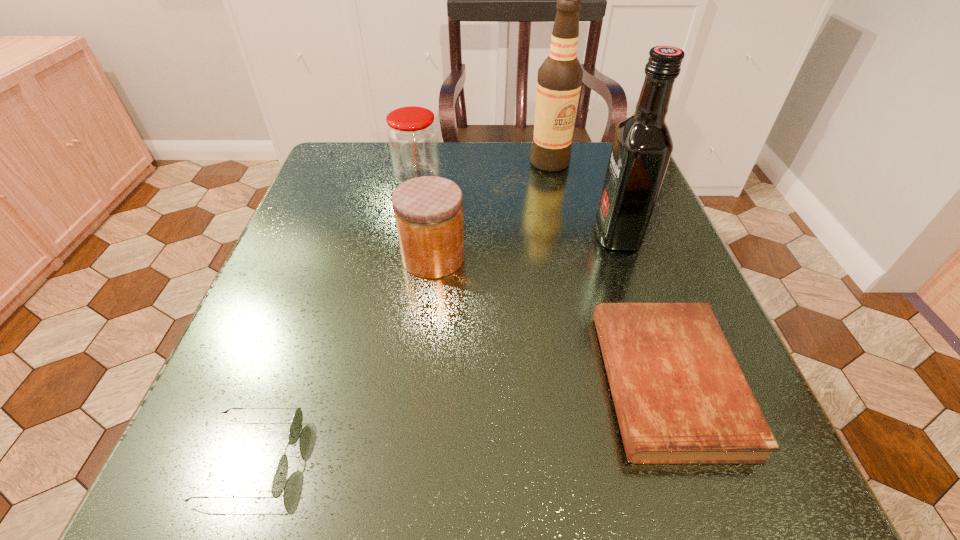
The image size is (960, 540). In the image, there is a desktop. What are the coordinates of `blank space at the right edge` in the screenshot? It's located at (612, 278).

In the image, there is a desktop. Where is `free space at the far left corner`? free space at the far left corner is located at coordinates (366, 195).

Find the location of `vacant space at the far right corner of the desktop`. vacant space at the far right corner of the desktop is located at coordinates click(x=594, y=184).

At what (x,y) coordinates should I click in order to perform the action: click on vacant point located between the nearer jar and the sunglasses. Please return your answer as a coordinate pair (x, y). Looking at the image, I should click on (342, 358).

Identify the location of free spot between the farther jar and the liquor. This screenshot has width=960, height=540. (517, 207).

At what (x,y) coordinates should I click in order to perform the action: click on vacant area that lies between the farther jar and the alcohol. Please return your answer as a coordinate pair (x, y). The height and width of the screenshot is (540, 960). Looking at the image, I should click on (484, 171).

You are a GUI agent. You are given a task and a screenshot of the screen. Output one action in this format:
    pyautogui.click(x=<x>, y=<y>)
    Task: Click on the free space between the sunglasses and the liquor
    The image size is (960, 540).
    Given the screenshot: What is the action you would take?
    pyautogui.click(x=434, y=347)

Where is `vacant space that's between the alcohol and the farther jar`? The image size is (960, 540). vacant space that's between the alcohol and the farther jar is located at coordinates (484, 171).

At what (x,y) coordinates should I click in order to perform the action: click on free space between the Bible and the nearer jar. Please return your answer as a coordinate pair (x, y). Image resolution: width=960 pixels, height=540 pixels. Looking at the image, I should click on (550, 320).

The image size is (960, 540). I want to click on unoccupied area between the alcohol and the Bible, so click(609, 272).